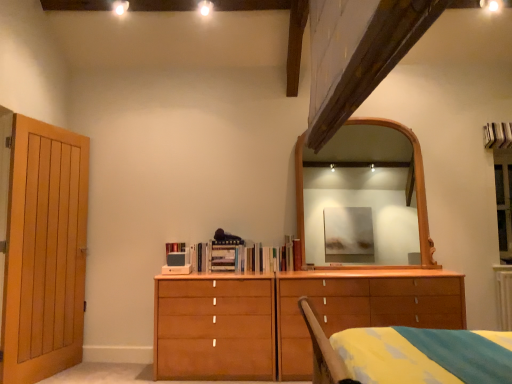
The height and width of the screenshot is (384, 512). Describe the element at coordinates (44, 252) in the screenshot. I see `light brown wooden door at left` at that location.

This screenshot has width=512, height=384. What are the coordinates of `light brown wooden door at left` in the screenshot? It's located at (44, 252).

Where is `light brown wooden door at left`? This screenshot has height=384, width=512. light brown wooden door at left is located at coordinates (44, 252).